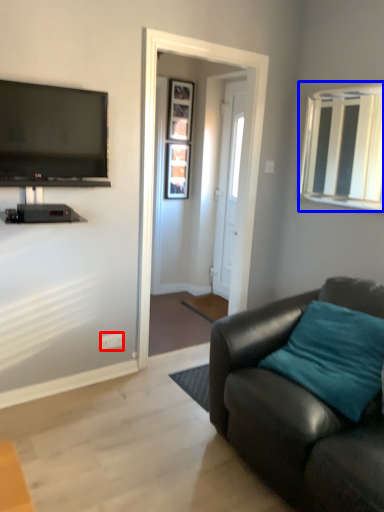
Question: Among these objects, which one is nearest to the camera, power outlet (highlighted by a red box) or window (highlighted by a blue box)?

Choices:
 (A) power outlet
 (B) window

Answer: (B)